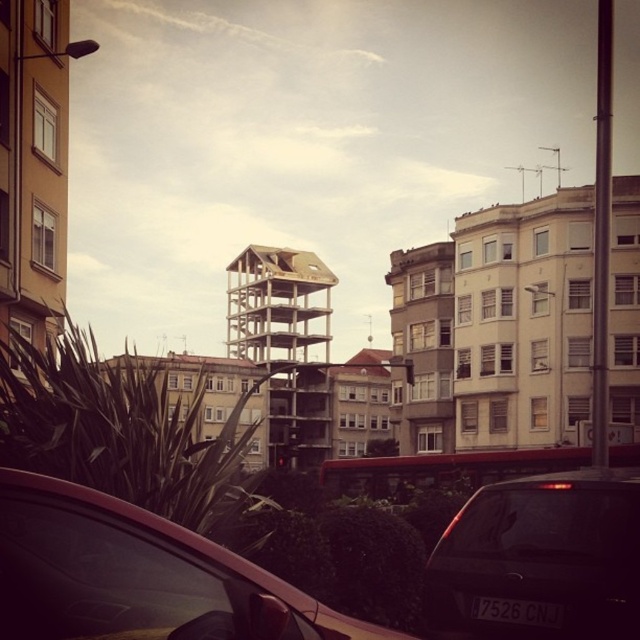
You are a pedestrian standing on the sidewalk and want to cross the street to reach the white matte building at center. Is the matte red car at lower left blocking your path?

The white matte building at center is positioned over the matte red car at lower left, meaning the car is directly in front of the building. Therefore, the matte red car at lower left is blocking your path to the white matte building at center.

You are standing at the origin of the coordinate system in the image. You see two points, point (529, 221) and point (257, 312). Which point is closer to you?

Point (529, 221) is in front of point (257, 312), so it is closer to you.

You are standing at the point labeled as point (524, 321) in the image. Looking around, you see a white matte building at center. Which direction should you face to see the white matte building at center?

Since the point (524, 321) corresponds to the white matte building at center, you are already facing the white matte building at center.